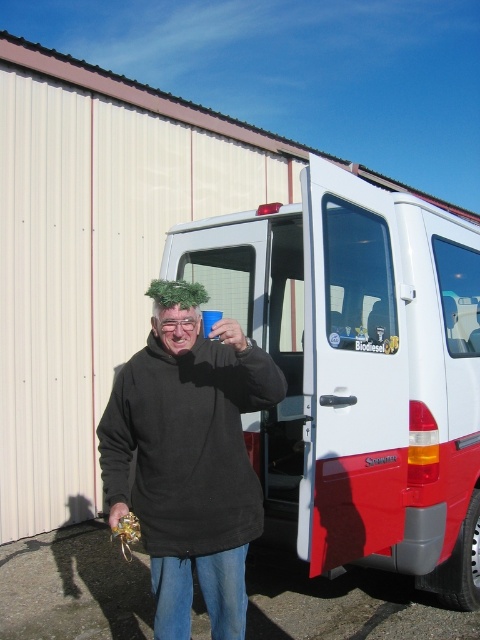
Question: Is white matte van at center to the left of black fleece at center from the viewer's perspective?

Choices:
 (A) yes
 (B) no

Answer: (B)

Question: Can you confirm if white matte van at center is positioned above black fleece at center?

Choices:
 (A) yes
 (B) no

Answer: (A)

Question: Which object is closer to the camera taking this photo?

Choices:
 (A) black fleece at center
 (B) white matte van at center

Answer: (A)

Question: Is white matte van at center below black fleece at center?

Choices:
 (A) yes
 (B) no

Answer: (B)

Question: Which of the following is the closest to the observer?

Choices:
 (A) black fleece at center
 (B) white matte van at center

Answer: (A)